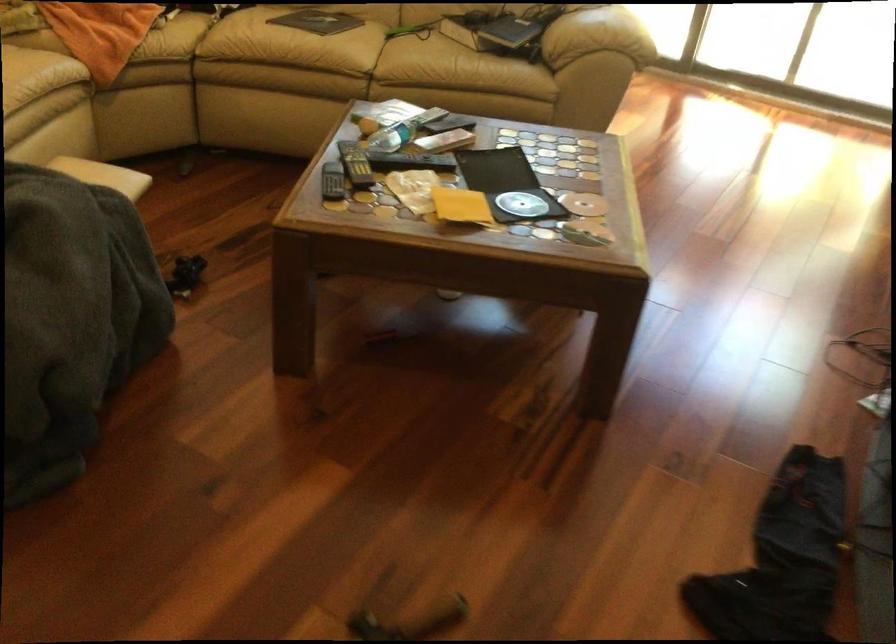
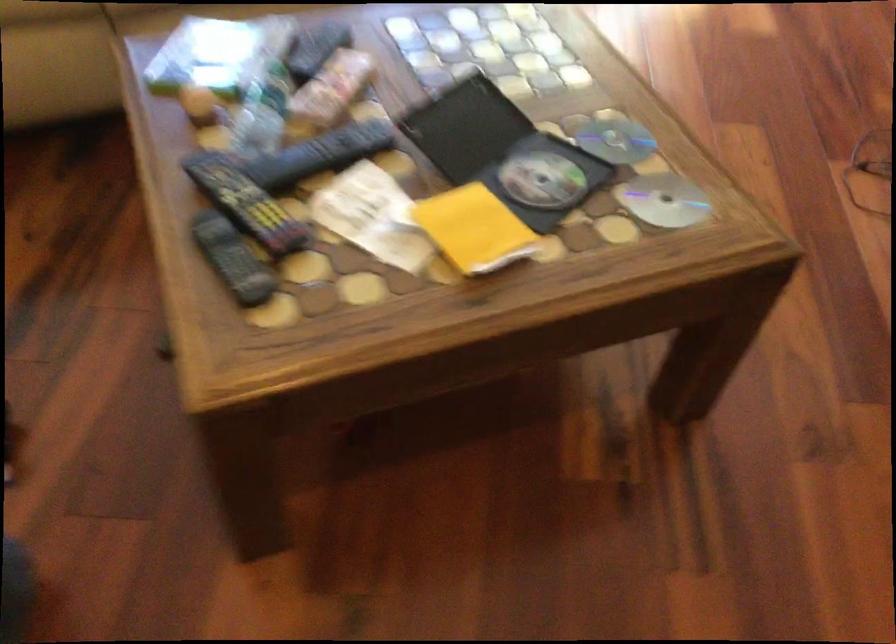
Locate, in the second image, the point that corresponds to point (512, 187) in the first image.

(503, 152)